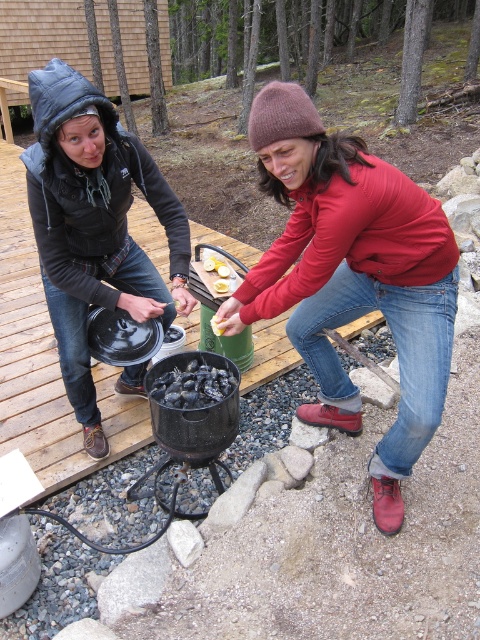
Is the position of yellow rubber glove at center more distant than that of yellow matte lemon at center?

No, it is in front of yellow matte lemon at center.

Can you confirm if yellow rubber glove at center is thinner than yellow matte lemon at center?

In fact, yellow rubber glove at center might be wider than yellow matte lemon at center.

Describe the element at coordinates (218, 276) in the screenshot. I see `yellow rubber glove at center` at that location.

This screenshot has width=480, height=640. I want to click on yellow rubber glove at center, so click(218, 276).

Can you confirm if charcoal briquettes at center is positioned below yellow soft-boiled egg at center?

Indeed, charcoal briquettes at center is positioned under yellow soft-boiled egg at center.

Describe the element at coordinates (192, 385) in the screenshot. I see `charcoal briquettes at center` at that location.

Where is `charcoal briquettes at center`? charcoal briquettes at center is located at coordinates (192, 385).

In the scene shown: Which is above, charcoal briquettes at center or yellow rubber glove at center?

Positioned higher is yellow rubber glove at center.

Is charcoal briquettes at center to the right of yellow rubber glove at center from the viewer's perspective?

Incorrect, charcoal briquettes at center is not on the right side of yellow rubber glove at center.

Which is behind, point (177, 381) or point (218, 280)?

Positioned behind is point (218, 280).

At what (x,y) coordinates should I click in order to perform the action: click on charcoal briquettes at center. Please return your answer as a coordinate pair (x, y). Looking at the image, I should click on (192, 385).